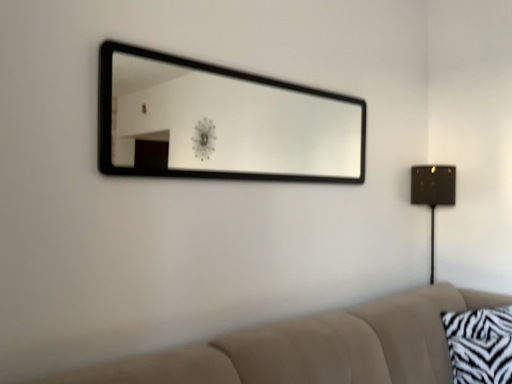
In order to click on metallic gold table lamp at right in this screenshot , I will do `click(433, 192)`.

At what (x,y) coordinates should I click in order to perform the action: click on black frame mirror at upper center. Please return your answer as a coordinate pair (x, y). The image size is (512, 384). Looking at the image, I should click on (231, 123).

Describe the element at coordinates (315, 347) in the screenshot. Image resolution: width=512 pixels, height=384 pixels. I see `beige fabric couch at lower right` at that location.

Describe the element at coordinates (480, 345) in the screenshot. I see `zebra-patterned fabric pillow at lower right` at that location.

The width and height of the screenshot is (512, 384). Find the location of `metallic gold table lamp at right`. metallic gold table lamp at right is located at coordinates (433, 192).

From a real-world perspective, does zebra-patterned fabric pillow at lower right sit lower than beige fabric couch at lower right?

Yes, from a real-world perspective, zebra-patterned fabric pillow at lower right is beneath beige fabric couch at lower right.

Who is taller, zebra-patterned fabric pillow at lower right or beige fabric couch at lower right?

With more height is beige fabric couch at lower right.

Which object is thinner, zebra-patterned fabric pillow at lower right or beige fabric couch at lower right?

zebra-patterned fabric pillow at lower right is thinner.

Would you consider zebra-patterned fabric pillow at lower right to be distant from beige fabric couch at lower right?

That's not correct — zebra-patterned fabric pillow at lower right is a little close to beige fabric couch at lower right.

From a real-world perspective, which is physically above, beige fabric couch at lower right or black frame mirror at upper center?

From a 3D spatial view, black frame mirror at upper center is above.

Could you tell me if beige fabric couch at lower right is turned towards black frame mirror at upper center?

No, beige fabric couch at lower right is not facing towards black frame mirror at upper center.

From the image's perspective, relative to black frame mirror at upper center, is beige fabric couch at lower right above or below?

Based on their image positions, beige fabric couch at lower right is located beneath black frame mirror at upper center.

Based on the photo, visually, is beige fabric couch at lower right positioned to the left or to the right of black frame mirror at upper center?

Based on their positions, beige fabric couch at lower right is located to the right of black frame mirror at upper center.

Between metallic gold table lamp at right and beige fabric couch at lower right, which one has more height?

metallic gold table lamp at right.

Is metallic gold table lamp at right located outside beige fabric couch at lower right?

That's correct, metallic gold table lamp at right is outside of beige fabric couch at lower right.

Between point (431, 187) and point (123, 380), which one is positioned behind?

The point (431, 187) is behind.

Can you confirm if metallic gold table lamp at right is positioned to the left of beige fabric couch at lower right?

No.

Is metallic gold table lamp at right closer to camera compared to black frame mirror at upper center?

No, it is behind black frame mirror at upper center.

Is metallic gold table lamp at right positioned beyond the bounds of black frame mirror at upper center?

metallic gold table lamp at right is positioned outside black frame mirror at upper center.

Between point (437, 194) and point (147, 115), which one is positioned behind?

The point (147, 115) is behind.

Which of these two, metallic gold table lamp at right or black frame mirror at upper center, is thinner?

With smaller width is black frame mirror at upper center.

Find the location of `pillow below the metallic gold table lamp at right (from the image's perspective)`. pillow below the metallic gold table lamp at right (from the image's perspective) is located at coordinates (480, 345).

Can you confirm if metallic gold table lamp at right is wider than zebra-patterned fabric pillow at lower right?

No.

What's the angular difference between metallic gold table lamp at right and zebra-patterned fabric pillow at lower right's facing directions?

40.7 degrees.

From the picture: From the image's perspective, is metallic gold table lamp at right over zebra-patterned fabric pillow at lower right?

Yes, from the image's perspective, metallic gold table lamp at right is above zebra-patterned fabric pillow at lower right.

Which object is thinner, beige fabric couch at lower right or zebra-patterned fabric pillow at lower right?

zebra-patterned fabric pillow at lower right.

Is beige fabric couch at lower right not close to zebra-patterned fabric pillow at lower right?

No, beige fabric couch at lower right is in close proximity to zebra-patterned fabric pillow at lower right.

Is beige fabric couch at lower right shorter than zebra-patterned fabric pillow at lower right?

No, beige fabric couch at lower right is not shorter than zebra-patterned fabric pillow at lower right.

Is beige fabric couch at lower right in front of or behind zebra-patterned fabric pillow at lower right in the image?

beige fabric couch at lower right is positioned closer to the viewer than zebra-patterned fabric pillow at lower right.

From the image's perspective, between zebra-patterned fabric pillow at lower right and metallic gold table lamp at right, which one is located above?

metallic gold table lamp at right, from the image's perspective.

From a real-world perspective, does zebra-patterned fabric pillow at lower right sit lower than metallic gold table lamp at right?

Yes, from a real-world perspective, zebra-patterned fabric pillow at lower right is under metallic gold table lamp at right.

In the image, there is a metallic gold table lamp at right. At what (x,y) coordinates should I click in order to perform the action: click on pillow below it (from a real-world perspective). Please return your answer as a coordinate pair (x, y). Looking at the image, I should click on point(480,345).

Identify the location of studio couch in front of the zebra-patterned fabric pillow at lower right. The width and height of the screenshot is (512, 384). (315, 347).

Where is `mirror on the left of beige fabric couch at lower right`? mirror on the left of beige fabric couch at lower right is located at coordinates (231, 123).

Estimate the real-world distances between objects in this image. Which object is closer to metallic gold table lamp at right, black frame mirror at upper center or beige fabric couch at lower right?

beige fabric couch at lower right is positioned closer to the anchor metallic gold table lamp at right.

Considering their positions, is zebra-patterned fabric pillow at lower right positioned closer to black frame mirror at upper center than metallic gold table lamp at right?

The object closer to black frame mirror at upper center is metallic gold table lamp at right.

From the image, which object appears to be farther from zebra-patterned fabric pillow at lower right, beige fabric couch at lower right or black frame mirror at upper center?

black frame mirror at upper center is positioned further to the anchor zebra-patterned fabric pillow at lower right.

Looking at the image, which one is located closer to beige fabric couch at lower right, black frame mirror at upper center or zebra-patterned fabric pillow at lower right?

zebra-patterned fabric pillow at lower right is positioned closer to the anchor beige fabric couch at lower right.

Based on their spatial positions, is black frame mirror at upper center or metallic gold table lamp at right closer to zebra-patterned fabric pillow at lower right?

metallic gold table lamp at right lies closer to zebra-patterned fabric pillow at lower right than the other object.

From the image, which object appears to be farther from metallic gold table lamp at right, beige fabric couch at lower right or black frame mirror at upper center?

black frame mirror at upper center is positioned further to the anchor metallic gold table lamp at right.

Looking at the image, which one is located closer to black frame mirror at upper center, metallic gold table lamp at right or beige fabric couch at lower right?

metallic gold table lamp at right is positioned closer to the anchor black frame mirror at upper center.

Which object lies further to the anchor point metallic gold table lamp at right, zebra-patterned fabric pillow at lower right or beige fabric couch at lower right?

The object further to metallic gold table lamp at right is beige fabric couch at lower right.

Image resolution: width=512 pixels, height=384 pixels. I want to click on pillow positioned between beige fabric couch at lower right and metallic gold table lamp at right from near to far, so click(x=480, y=345).

I want to click on pillow between black frame mirror at upper center and metallic gold table lamp at right, so click(480, 345).

You are a GUI agent. You are given a task and a screenshot of the screen. Output one action in this format:
    pyautogui.click(x=<x>, y=<y>)
    Task: Click on the mirror between beige fabric couch at lower right and metallic gold table lamp at right from front to back
    
    Given the screenshot: What is the action you would take?
    pyautogui.click(x=231, y=123)

You are a GUI agent. You are given a task and a screenshot of the screen. Output one action in this format:
    pyautogui.click(x=<x>, y=<y>)
    Task: Click on the mirror between beige fabric couch at lower right and zebra-patterned fabric pillow at lower right from front to back
    The height and width of the screenshot is (384, 512).
    Given the screenshot: What is the action you would take?
    pos(231,123)